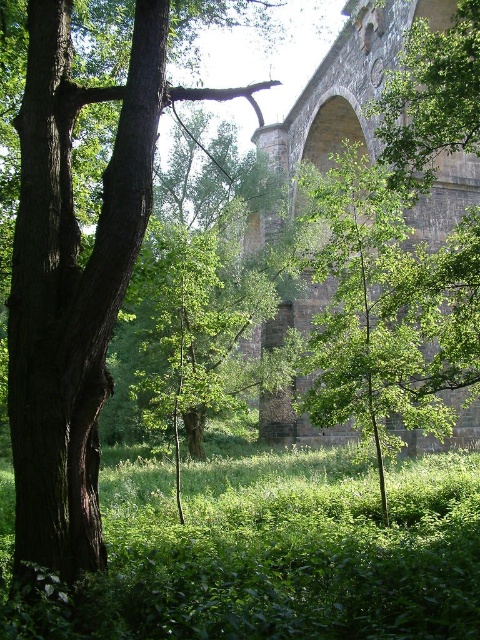
You are standing at the stone bridge and want to cross to the other side. You notice green leafy grass at center and dark brown bark tree at left. Which object is wider when viewed from your position?

The green leafy grass at center is wider than the dark brown bark tree at left.

You are an architect planning to build a new structure in this area. You need to consider the existing dark brown bark tree at left and the stone arch bridge at center. Which of these two objects is smaller in size?

The dark brown bark tree at left has a smaller size compared to the stone arch bridge at center, so the dark brown bark tree at left is the smaller one.

You are standing in the natural setting and want to cross the stone arch bridge at center. To avoid stepping on the green leafy grass at center, where should you walk?

The green leafy grass at center is located below the stone arch bridge at center, so you should walk on the bridge itself to avoid stepping on the grass.